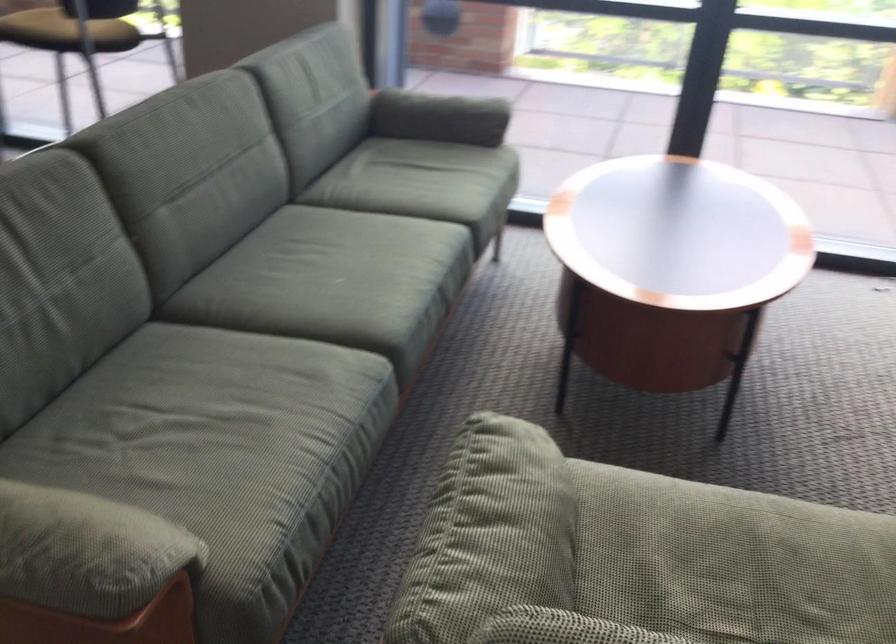
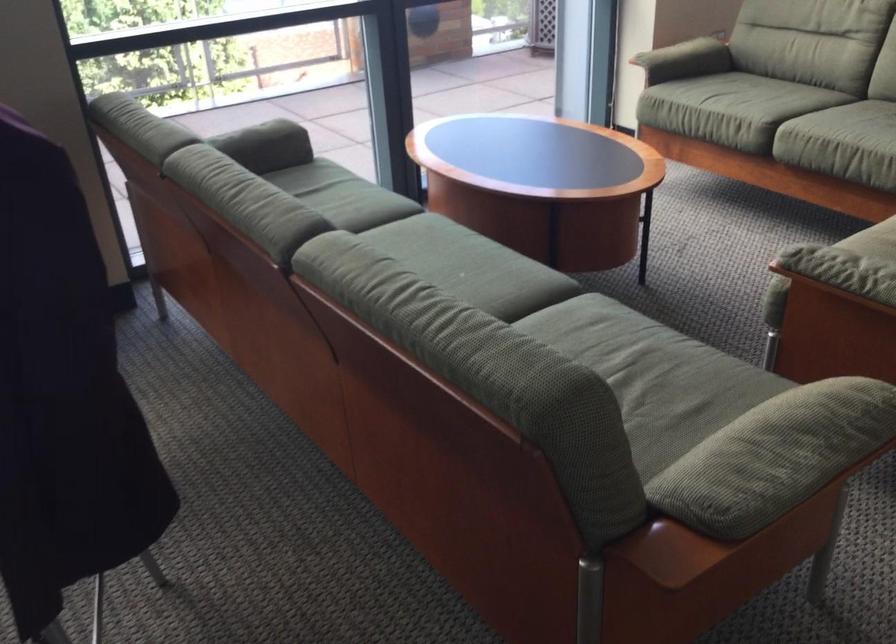
The point at (463, 468) is marked in the first image. Where is the corresponding point in the second image?

(834, 263)